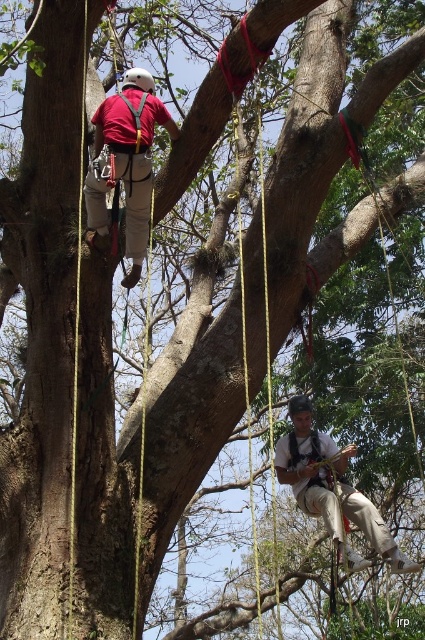
Question: Is matte red shirt at upper left positioned behind matte khaki pants at lower right?

Choices:
 (A) yes
 (B) no

Answer: (B)

Question: In this image, where is matte red shirt at upper left located relative to matte khaki pants at lower right?

Choices:
 (A) right
 (B) left

Answer: (B)

Question: Can you confirm if matte red shirt at upper left is positioned above matte khaki pants at lower right?

Choices:
 (A) yes
 (B) no

Answer: (A)

Question: Among these points, which one is farthest from the camera?

Choices:
 (A) (136, 90)
 (B) (295, 477)

Answer: (B)